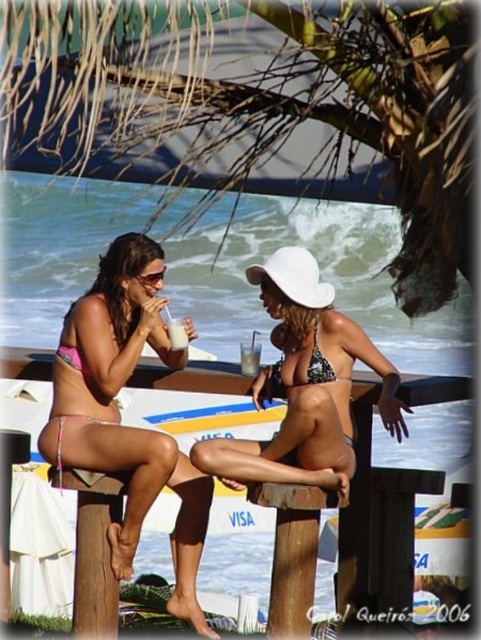
Question: Which point is closer to the camera?

Choices:
 (A) pink bikini bottom at center
 (B) printed bikini at center

Answer: (A)

Question: Which point is closer to the camera taking this photo?

Choices:
 (A) (177, 339)
 (B) (255, 392)
 (C) (76, 401)
 (D) (314, 372)

Answer: (C)

Question: Which point is closer to the camera?

Choices:
 (A) printed bikini at center
 (B) black sequined bikini at center
 (C) pink bikini bottom at center
 (D) white matte cup at center

Answer: (C)

Question: Where is pink bikini bottom at center located in relation to black sequined bikini at center in the image?

Choices:
 (A) left
 (B) right

Answer: (A)

Question: Does printed bikini at center have a larger size compared to black sequined bikini at center?

Choices:
 (A) no
 (B) yes

Answer: (A)

Question: Does printed bikini at center appear under white frothy drink at center?

Choices:
 (A) yes
 (B) no

Answer: (A)